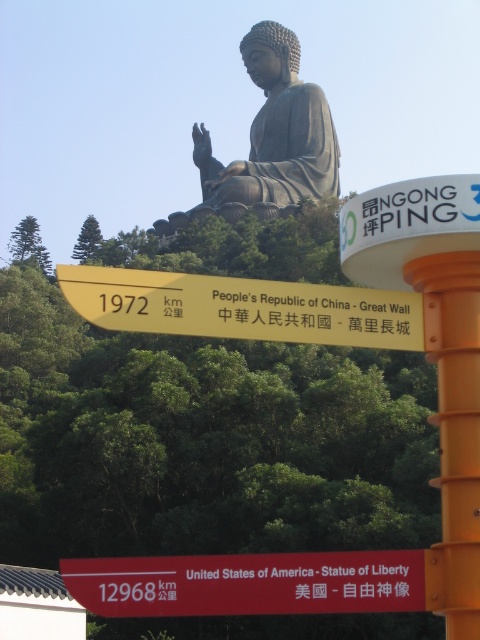
You are a tourist trying to take a photo of the bronze statue at upper center without the orange plastic pole at right appearing in the frame. Based on their widths, can you estimate if this is possible?

The bronze statue at upper center might be wider than orange plastic pole at right. Since the statue could be wider, it might block the pole if positioned correctly, making it possible to frame the photo without the pole appearing.

You are a hiker who wants to take a photo of both the yellow metallic sign at upper center and the orange plastic pole at right. Based on their positions, which object should you focus on first to ensure both are in frame?

The yellow metallic sign at upper center is closer to the viewer than the orange plastic pole at right, so focus on the yellow metallic sign at upper center first to ensure both are in frame.